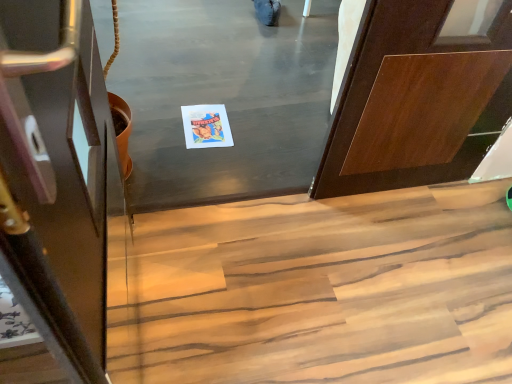
Find the location of a particular element. This screenshot has height=384, width=512. free point above matte paper postcard at center (from a real-world perspective) is located at coordinates (204, 120).